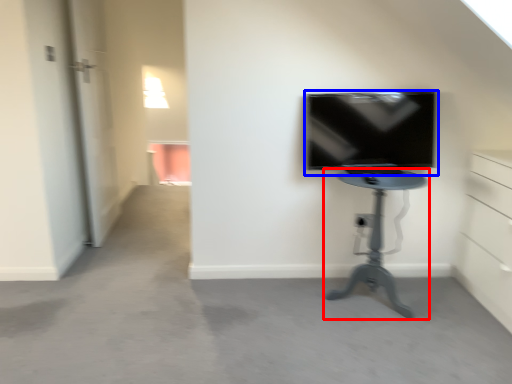
Question: Which object is further to the camera taking this photo, furniture (highlighted by a red box) or television (highlighted by a blue box)?

Choices:
 (A) furniture
 (B) television

Answer: (B)